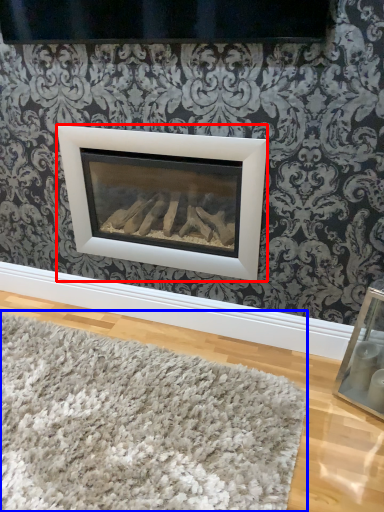
Question: Which object is closer to the camera taking this photo, fireplace (highlighted by a red box) or mat (highlighted by a blue box)?

Choices:
 (A) fireplace
 (B) mat

Answer: (B)